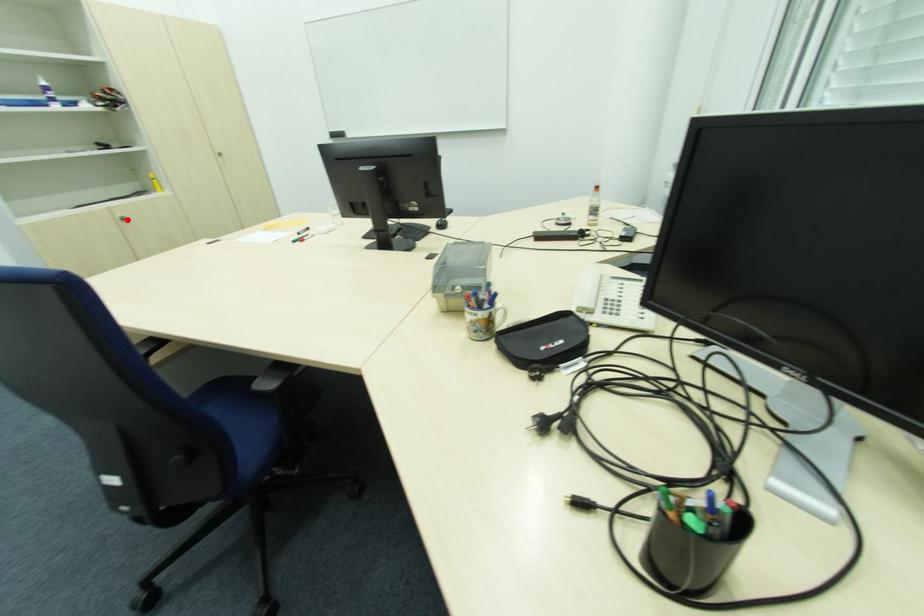
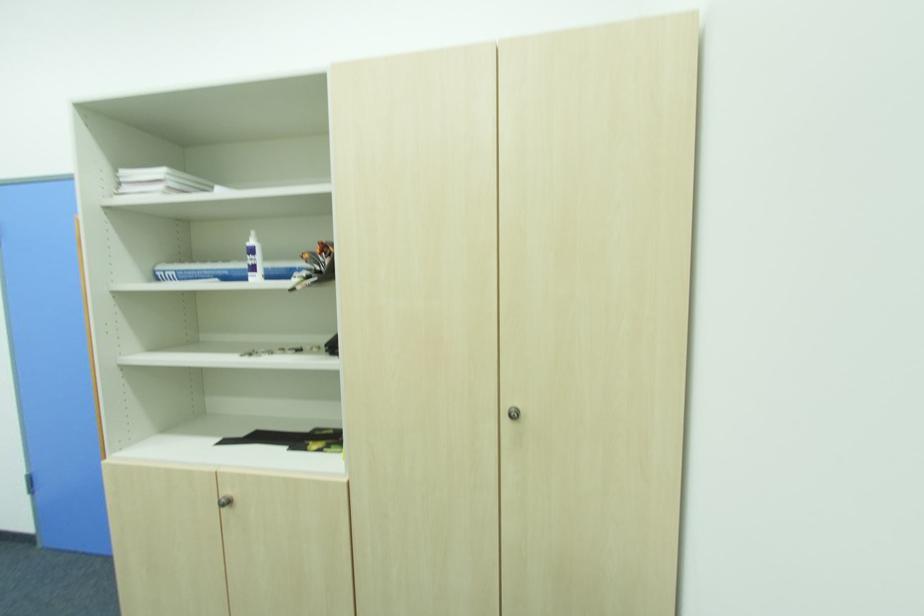
Question: A red point is marked in image1. In image2, is the corresponding 3D point closer to the camera or farther? Reply with the corresponding letter.

Choices:
 (A) The corresponding 3D point is closer.
 (B) The corresponding 3D point is farther.

Answer: (A)